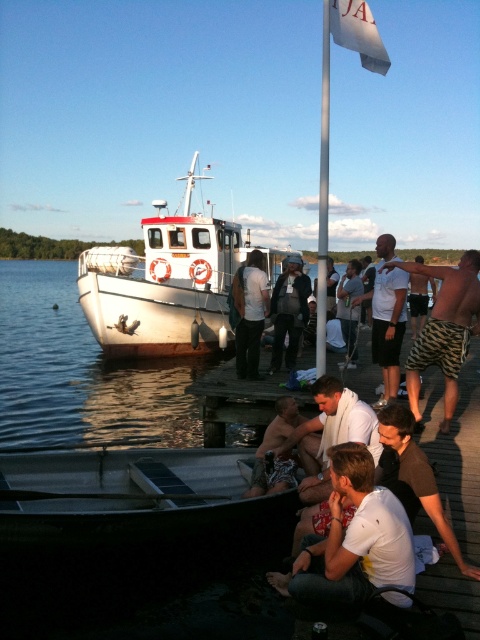
You are a photographer standing on the dock and want to take a picture of the white matte shirt at lower center and the dark gray pants at center. Which of the two items is shorter in height?

The white matte shirt at lower center is not as tall as dark gray pants at center, so the white matte shirt at lower center is shorter in height.

You are standing on the dock and want to move from the white glossy water at boat left to the white cotton shirt at lower center. In which direction should you move?

You should move to the right because the white glossy water at boat left is to the left of the white cotton shirt at lower center.